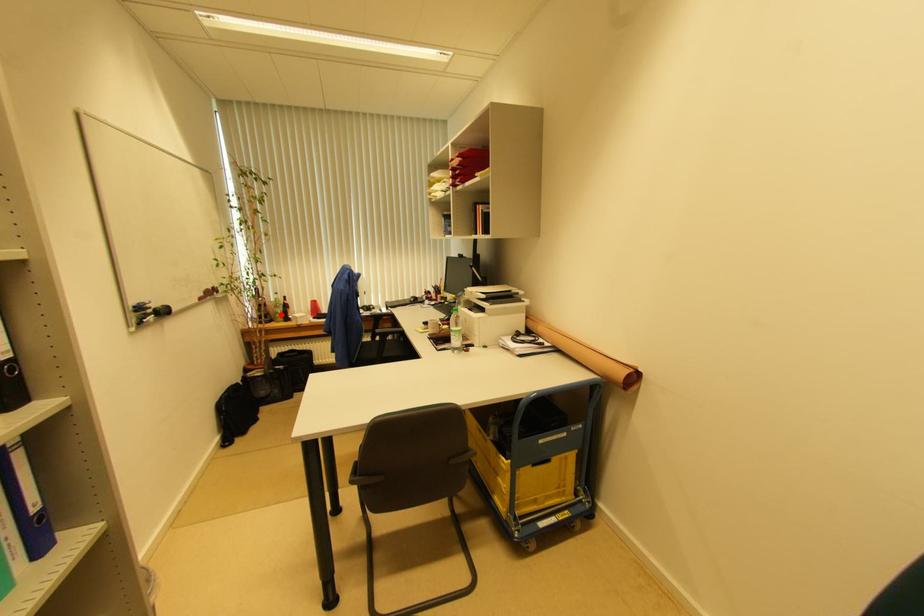
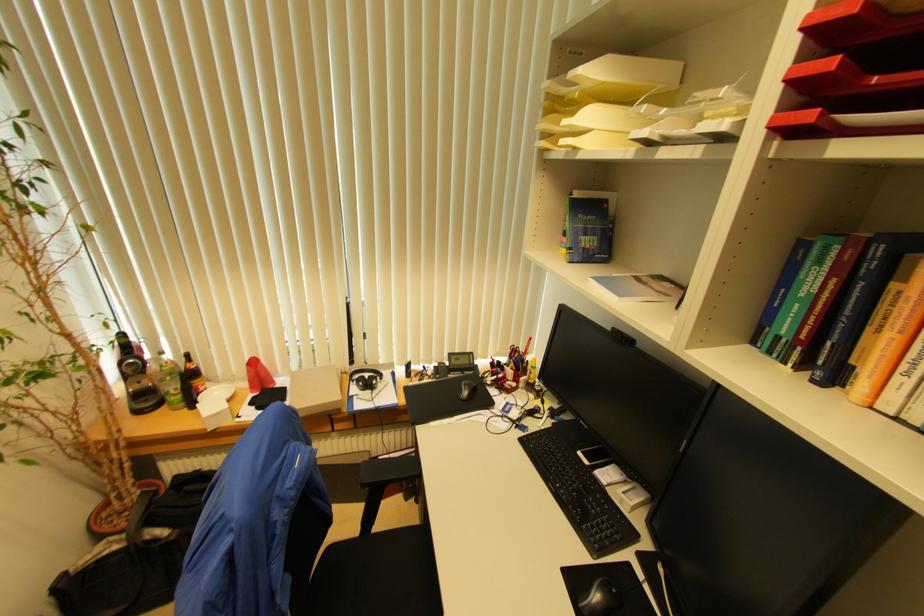
Find the pixel in the second image that matches the highlighted location in the first image.

(174, 394)